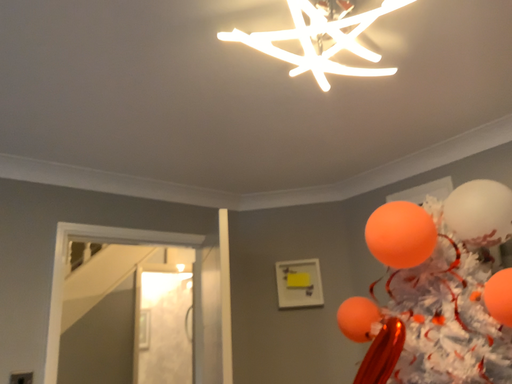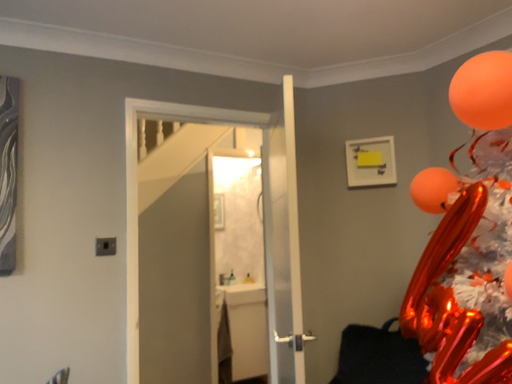
Question: Which way did the camera rotate in the video?

Choices:
 (A) rotated upward
 (B) rotated downward

Answer: (B)